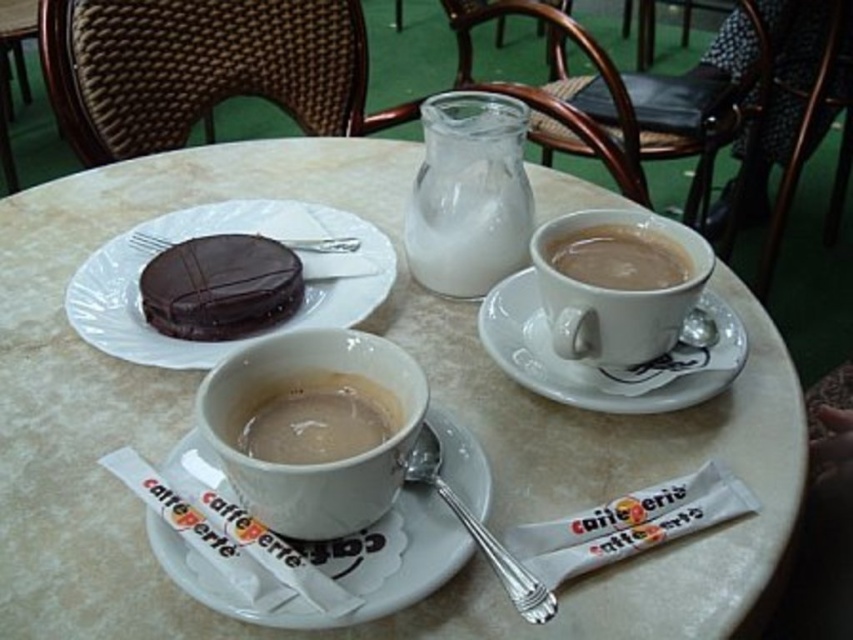
Question: Does white ceramic saucer at center appear on the right side of matte white cup at center?

Choices:
 (A) no
 (B) yes

Answer: (B)

Question: Can you confirm if chocolate glazed cake at center is positioned above milky glass pitcher at center?

Choices:
 (A) yes
 (B) no

Answer: (B)

Question: Among these points, which one is farthest from the camera?

Choices:
 (A) (349, 417)
 (B) (538, 365)

Answer: (B)

Question: Which point is farther to the camera?

Choices:
 (A) (430, 164)
 (B) (505, 292)
 (C) (648, 481)
 (D) (354, 609)

Answer: (A)

Question: Is white ceramic saucer at center behind white ceramic saucer at upper right?

Choices:
 (A) no
 (B) yes

Answer: (A)

Question: Which point is closer to the camera?

Choices:
 (A) milky glass pitcher at center
 (B) chocolatesmoothcake at left

Answer: (B)